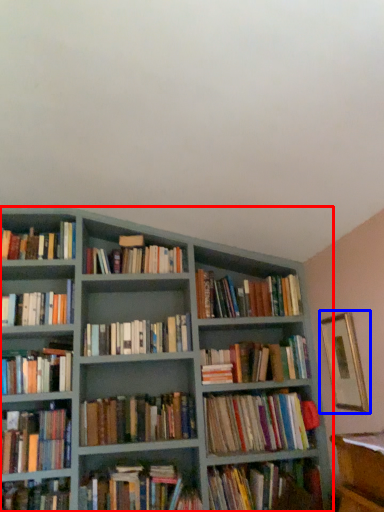
Question: Which point is closer to the camera, bookcase (highlighted by a red box) or picture frame (highlighted by a blue box)?

Choices:
 (A) bookcase
 (B) picture frame

Answer: (B)